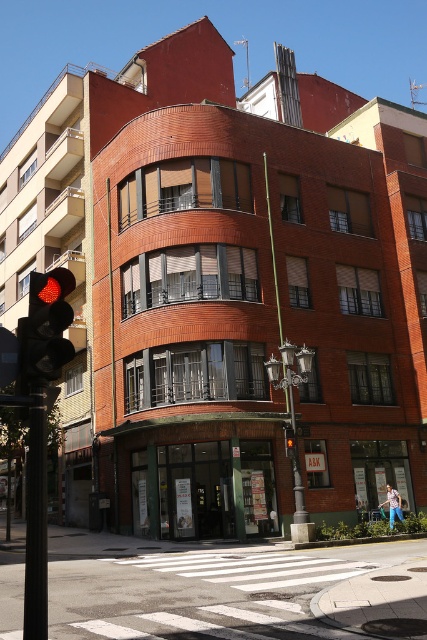
Question: Which point is farther to the camera?

Choices:
 (A) black metal pole at left
 (B) red glass traffic light at center
 (C) green metal streetlight at center

Answer: (B)

Question: Which of the following is the closest to the observer?

Choices:
 (A) (292, 525)
 (B) (26, 323)
 (C) (38, 484)

Answer: (C)

Question: Which is nearer to the red glass traffic light at center?

Choices:
 (A) green metal streetlight at center
 (B) red glass traffic light at left

Answer: (A)

Question: Does black metal pole at left appear on the left side of red glass traffic light at left?

Choices:
 (A) yes
 (B) no

Answer: (A)

Question: Is green metal streetlight at center bigger than red glass traffic light at center?

Choices:
 (A) yes
 (B) no

Answer: (A)

Question: Is black metal pole at left closer to the viewer compared to green metal streetlight at center?

Choices:
 (A) no
 (B) yes

Answer: (B)